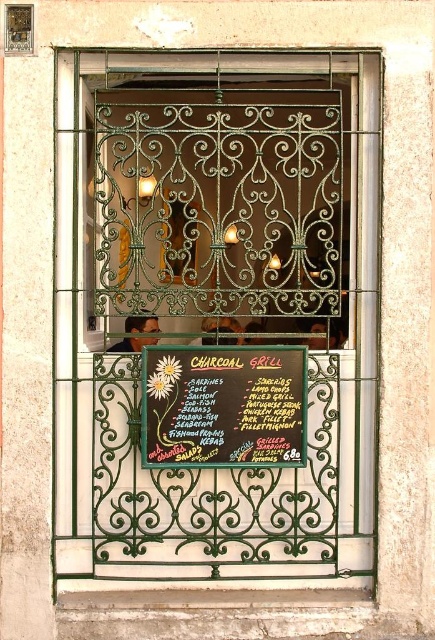
Image resolution: width=435 pixels, height=640 pixels. Identify the location of green wrought iron grill at center. (216, 312).

Is green wrought iron grill at center to the right of black chalkboard at center from the viewer's perspective?

Indeed, green wrought iron grill at center is positioned on the right side of black chalkboard at center.

Describe the element at coordinates (216, 312) in the screenshot. I see `green wrought iron grill at center` at that location.

Locate an element on the screen. green wrought iron grill at center is located at coordinates (216, 312).

Does green wrought iron grill at center appear over green wrought iron at center?

No.

Where is `green wrought iron grill at center`? The height and width of the screenshot is (640, 435). green wrought iron grill at center is located at coordinates (216, 312).

You are a GUI agent. You are given a task and a screenshot of the screen. Output one action in this format:
    pyautogui.click(x=<x>, y=<y>)
    Task: Click on the green wrought iron grill at center
    The height and width of the screenshot is (640, 435).
    Given the screenshot: What is the action you would take?
    [x=216, y=312]

Does green wrought iron at center have a lesser width compared to black chalkboard at center?

No, green wrought iron at center is not thinner than black chalkboard at center.

Which is more to the left, green wrought iron at center or black chalkboard at center?

Positioned to the left is black chalkboard at center.

Does point (300, 136) come closer to viewer compared to point (153, 413)?

That is False.

Where is `green wrought iron at center`? The width and height of the screenshot is (435, 640). green wrought iron at center is located at coordinates coord(223,198).